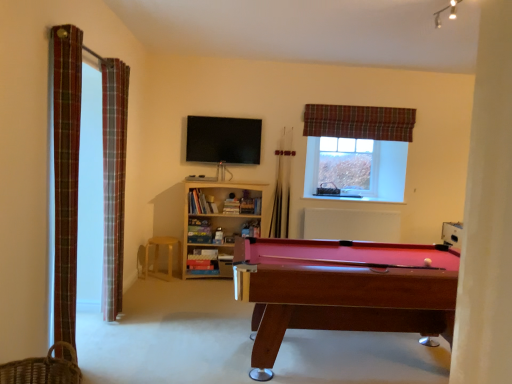
Question: From a real-world perspective, is matte black pool table at center above or below light wood stool at center?

Choices:
 (A) above
 (B) below

Answer: (A)

Question: Considering the relative positions of matte black pool table at center and light wood stool at center in the image provided, is matte black pool table at center to the left or to the right of light wood stool at center?

Choices:
 (A) left
 (B) right

Answer: (B)

Question: Which of these objects is positioned closest to the clear plastic window screen at upper right?

Choices:
 (A) woven brown basket at lower left
 (B) white matte radiator at center
 (C) matte black pool table at center
 (D) light wood/bookshelf at center
 (E) plaid fabric curtain at left, which is the 2th curtain in right-to-left order

Answer: (B)

Question: Which of these objects is positioned farthest from the light wood stool at center?

Choices:
 (A) plaid fabric curtain at left, which is the 2th curtain in right-to-left order
 (B) woven brown basket at lower left
 (C) light wood/bookshelf at center
 (D) plaid fabric curtain at upper right, which is counted as the third curtain, starting from the left
 (E) rubberized wood pool table at lower right

Answer: (B)